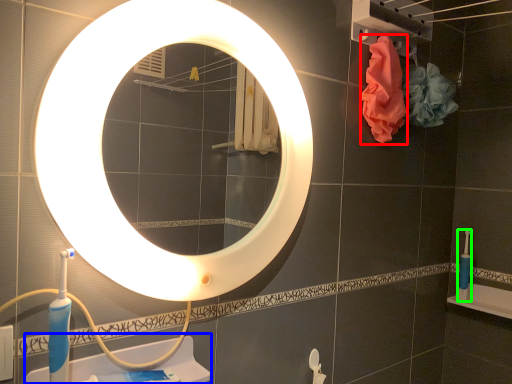
Question: Estimate the real-world distances between objects in this image. Which object is closer to material (highlighted by a red box), sink (highlighted by a blue box) or toothbrush (highlighted by a green box)?

Choices:
 (A) sink
 (B) toothbrush

Answer: (B)